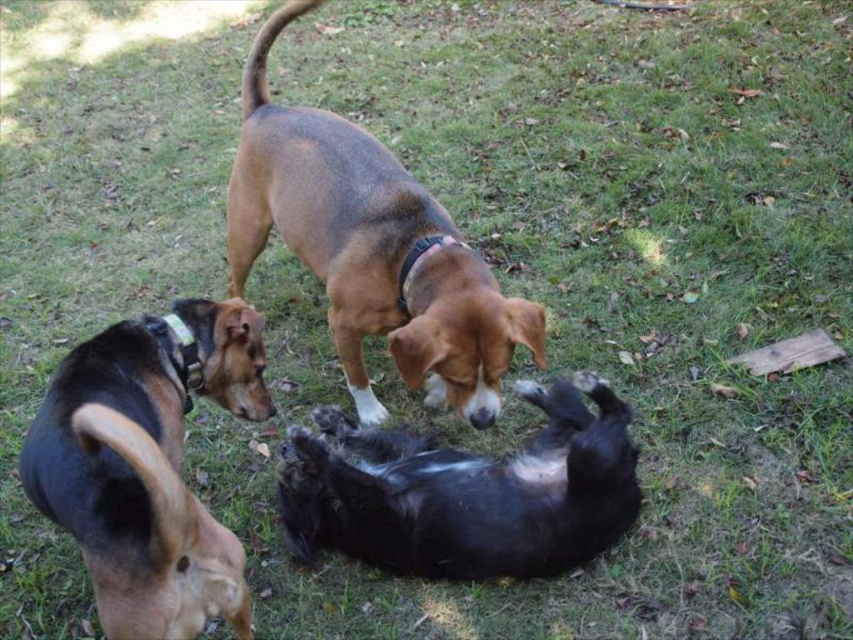
Measure the distance between brown matte dog at center and black fur dog at center.

The distance of brown matte dog at center from black fur dog at center is 15.10 inches.

Where is `brown matte dog at center`? This screenshot has width=853, height=640. brown matte dog at center is located at coordinates (370, 250).

I want to click on brown matte dog at center, so click(x=370, y=250).

Is brown fur dog at lower left further to camera compared to black fur dog at center?

No, brown fur dog at lower left is closer to the viewer.

Who is positioned more to the left, brown fur dog at lower left or black fur dog at center?

Positioned to the left is brown fur dog at lower left.

Find the location of `brown fur dog at lower left`. brown fur dog at lower left is located at coordinates (148, 465).

This screenshot has width=853, height=640. I want to click on brown fur dog at lower left, so click(x=148, y=465).

Is point (233, 163) farther from viewer compared to point (129, 496)?

Yes, it is behind point (129, 496).

Does brown matte dog at center appear on the left side of brown fur dog at lower left?

No, brown matte dog at center is not to the left of brown fur dog at lower left.

Does point (415, 237) lie behind point (164, 481)?

Yes.

Find the location of a particular element. The width and height of the screenshot is (853, 640). brown matte dog at center is located at coordinates (370, 250).